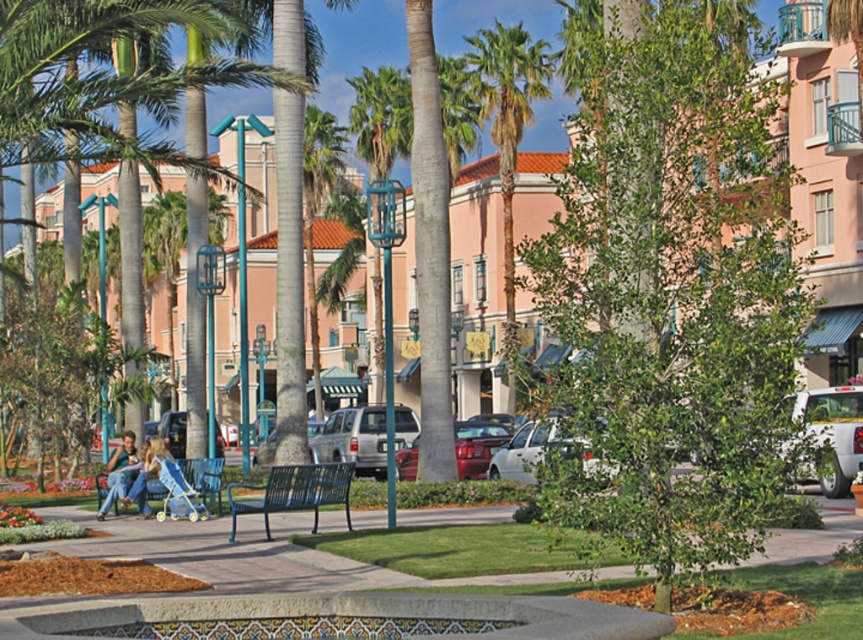
Is shiny red car at center below light blue stroller at lower left?

No, shiny red car at center is not below light blue stroller at lower left.

The width and height of the screenshot is (863, 640). I want to click on shiny red car at center, so point(476,445).

Identify the location of shiny red car at center. (476, 445).

Does point (523, 45) come in front of point (181, 506)?

No, (523, 45) is further to viewer.

Between green leafy palm tree at center and light blue stroller at lower left, which one is positioned lower?

Positioned lower is light blue stroller at lower left.

Is point (477, 93) closer to viewer compared to point (146, 456)?

No, (477, 93) is further to viewer.

Where is `green leafy palm tree at center`? Image resolution: width=863 pixels, height=640 pixels. green leafy palm tree at center is located at coordinates (507, 132).

Image resolution: width=863 pixels, height=640 pixels. I want to click on shiny red car at center, so click(x=476, y=445).

Does shiny red car at center have a greater width compared to metallic blue bench at lower left?

Yes, shiny red car at center is wider than metallic blue bench at lower left.

Locate an element on the screen. This screenshot has width=863, height=640. shiny red car at center is located at coordinates (476, 445).

I want to click on shiny red car at center, so click(476, 445).